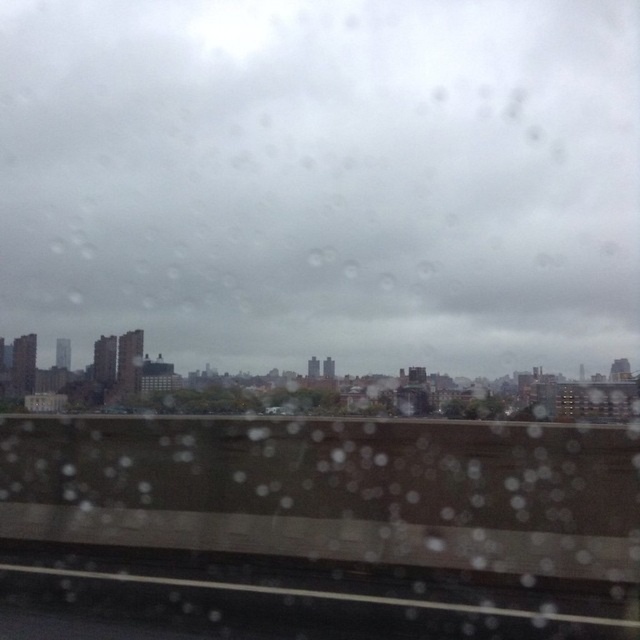
Question: Considering the relative positions of transparent glass at upper center and black rubber train track at lower center in the image provided, where is transparent glass at upper center located with respect to black rubber train track at lower center?

Choices:
 (A) right
 (B) left

Answer: (A)

Question: Which point appears farthest from the camera in this image?

Choices:
 (A) (211, 348)
 (B) (84, 580)

Answer: (A)

Question: Which of the following is the farthest from the observer?

Choices:
 (A) coord(449,616)
 (B) coord(362,184)

Answer: (B)

Question: Which object appears farthest from the camera in this image?

Choices:
 (A) transparent glass at upper center
 (B) black rubber train track at lower center

Answer: (A)

Question: Observing the image, what is the correct spatial positioning of transparent glass at upper center in reference to black rubber train track at lower center?

Choices:
 (A) right
 (B) left

Answer: (A)

Question: Can you confirm if transparent glass at upper center is positioned to the left of black rubber train track at lower center?

Choices:
 (A) yes
 (B) no

Answer: (B)